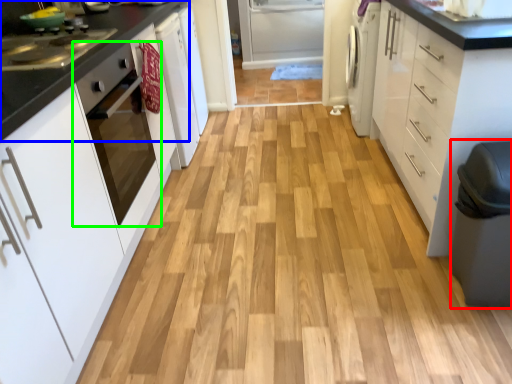
Question: Estimate the real-world distances between objects in this image. Which object is farther from step stool (highlighted by a red box), countertop (highlighted by a blue box) or home appliance (highlighted by a green box)?

Choices:
 (A) countertop
 (B) home appliance

Answer: (A)